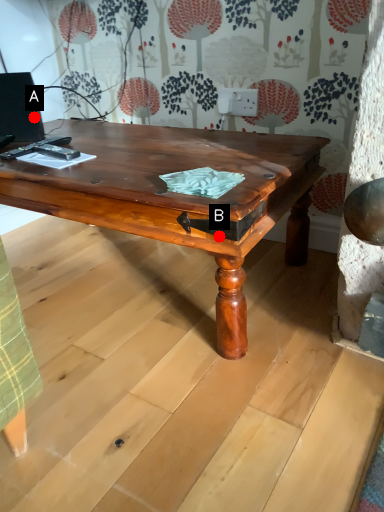
Question: Two points are circled on the image, labeled by A and B beside each circle. Among these points, which one is farthest from the camera?

Choices:
 (A) A is further
 (B) B is further

Answer: (A)